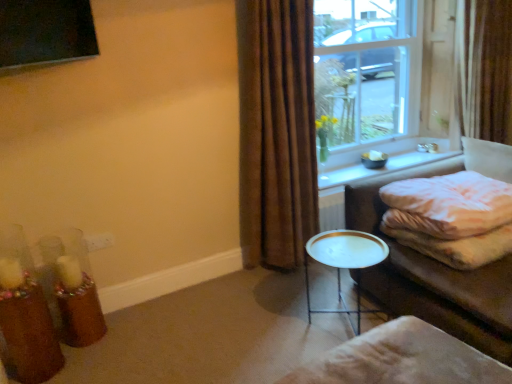
Question: Does clear glass window at upper right have a smaller size compared to brown fabric curtain at right, which is counted as the second curtain, starting from the front?

Choices:
 (A) yes
 (B) no

Answer: (B)

Question: From the image's perspective, does clear glass window at upper right appear lower than brown fabric curtain at right, which is counted as the 1th curtain, starting from the back?

Choices:
 (A) no
 (B) yes

Answer: (A)

Question: Is clear glass window at upper right wider than brown fabric curtain at right, which is counted as the second curtain, starting from the front?

Choices:
 (A) no
 (B) yes

Answer: (A)

Question: From a real-world perspective, is clear glass window at upper right under brown fabric curtain at right, which is counted as the second curtain, starting from the front?

Choices:
 (A) no
 (B) yes

Answer: (A)

Question: Can we say clear glass window at upper right lies outside brown fabric curtain at right, which is counted as the 1th curtain, starting from the back?

Choices:
 (A) yes
 (B) no

Answer: (A)

Question: Based on their positions, is beige fabric footrest at lower right located to the left or right of translucent glass candle holder at lower left, the 1th candle holder from the front?

Choices:
 (A) left
 (B) right

Answer: (B)

Question: From a real-world perspective, relative to translucent glass candle holder at lower left, the 1th candle holder from the front, is beige fabric footrest at lower right vertically above or below?

Choices:
 (A) below
 (B) above

Answer: (A)

Question: Is beige fabric footrest at lower right bigger or smaller than translucent glass candle holder at lower left, the 1th candle holder from the front?

Choices:
 (A) small
 (B) big

Answer: (B)

Question: From the image's perspective, relative to translucent glass candle holder at lower left, the 2th candle holder viewed from the back, is beige fabric footrest at lower right above or below?

Choices:
 (A) above
 (B) below

Answer: (B)

Question: Is brown velvet curtain at center, placed as the second curtain when sorted from right to left, in front of or behind white glossy window sill at upper right in the image?

Choices:
 (A) front
 (B) behind

Answer: (A)

Question: From a real-world perspective, is brown velvet curtain at center, placed as the second curtain when sorted from right to left, above or below white glossy window sill at upper right?

Choices:
 (A) above
 (B) below

Answer: (A)

Question: In terms of height, does brown velvet curtain at center, marked as the second curtain in a back-to-front arrangement, look taller or shorter compared to white glossy window sill at upper right?

Choices:
 (A) tall
 (B) short

Answer: (A)

Question: Is brown velvet curtain at center, marked as the second curtain in a back-to-front arrangement, bigger or smaller than white glossy window sill at upper right?

Choices:
 (A) small
 (B) big

Answer: (B)

Question: In terms of size, does translucent glass candle holder at lower left, the 2th candle holder viewed from the back, appear bigger or smaller than clear glass window at upper right?

Choices:
 (A) big
 (B) small

Answer: (B)

Question: From their relative heights in the image, would you say translucent glass candle holder at lower left, the 1th candle holder from the front, is taller or shorter than clear glass window at upper right?

Choices:
 (A) tall
 (B) short

Answer: (B)